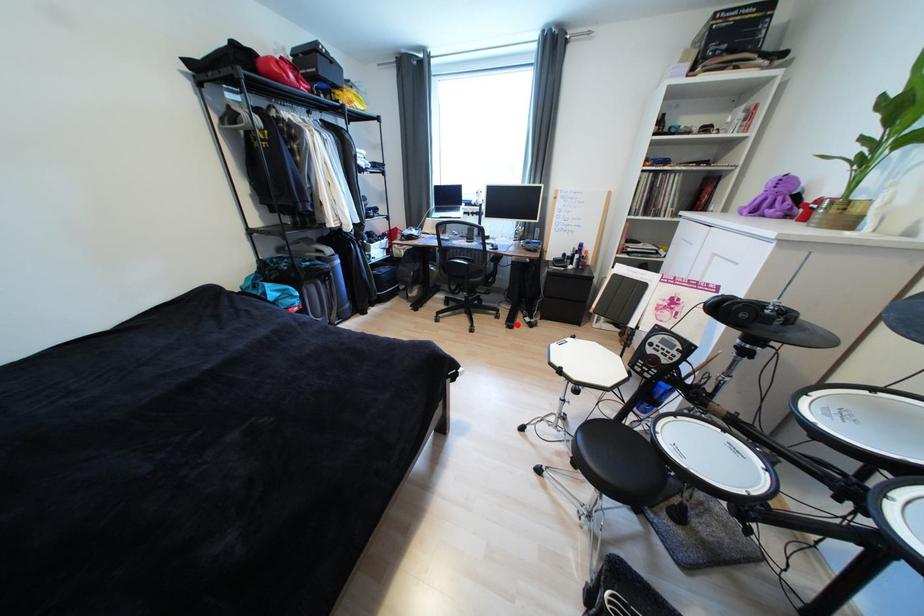
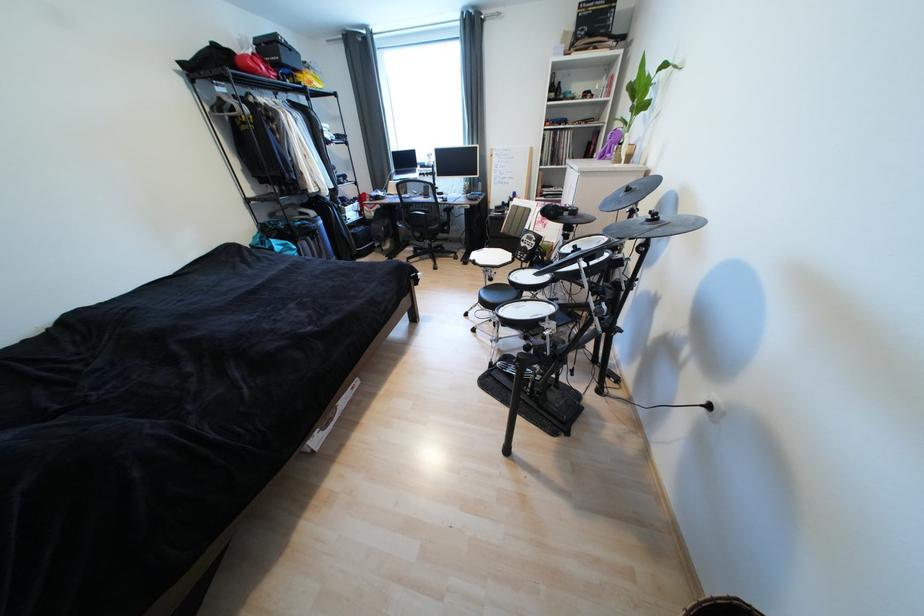
Question: I am providing you with two images of the same scene from different viewpoints. Given a red point in image1, look at the same physical point in image2. Is it:

Choices:
 (A) Closer to the viewpoint
 (B) Farther from the viewpoint

Answer: (B)